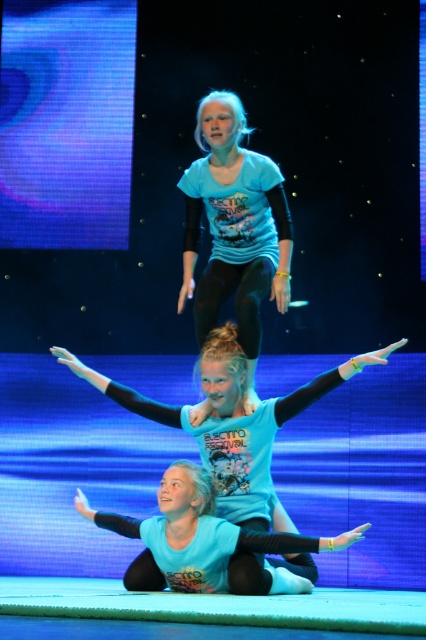
You are a stagehand observing the acrobatic performance. You need to adjust the lighting to highlight the performer wearing the matte blue leotard at center without affecting the one in matte blue leggings at lower center. Which performer should you focus the spotlight on and why?

You should focus the spotlight on the matte blue leotard at center because it is in front of the matte blue leggings at lower center, so the light will naturally highlight the front performer without significantly affecting the one behind.